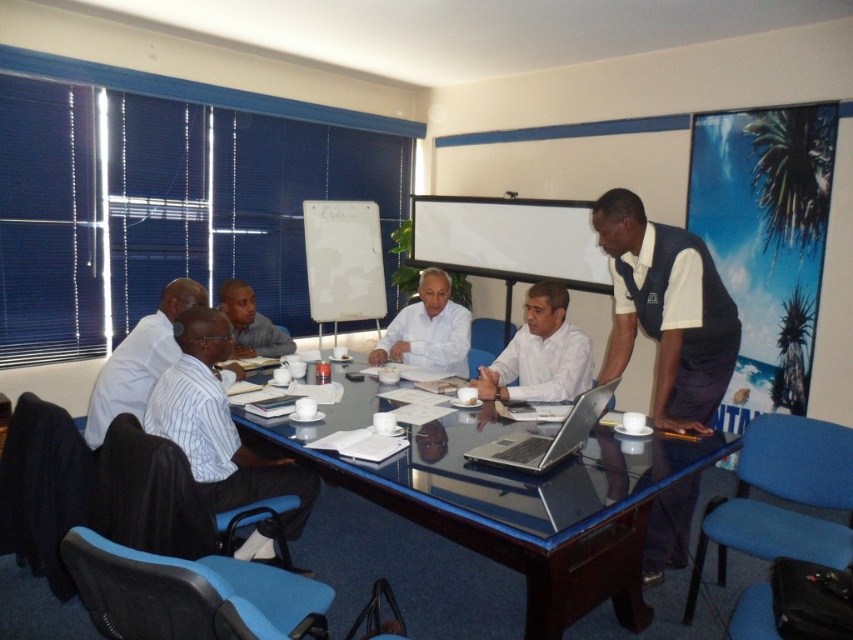
You are sitting at the conference table and need to place a 10cm tall document holder between the white shirt at left and the silver metallic laptop at center. Can you fit it vertically between them without tilting?

The white shirt at left is taller than the silver metallic laptop at center. Since the document holder is 10cm tall, it can be placed vertically between them as long as the space between their heights allows. However, the exact vertical clearance isn

You are organizing a small meeting in the conference room. You need to place a large presentation board that requires a surface area of 1.5 square meters. Can the transparent glass table at center accommodate the white shirt at center and the presentation board together?

The transparent glass table at center has a larger size compared to white shirt at center, so it can accommodate both the white shirt at center and the presentation board as long as the total area does not exceed 1.5 square meters.

You are organizing a meeting and need to ensure that all participants have enough space. Given that the white shirt at left and the silver metallic laptop at center are on the table, which object takes up more horizontal space on the table?

The silver metallic laptop at center takes up more horizontal space on the table because its width is greater than the white shirt at left.